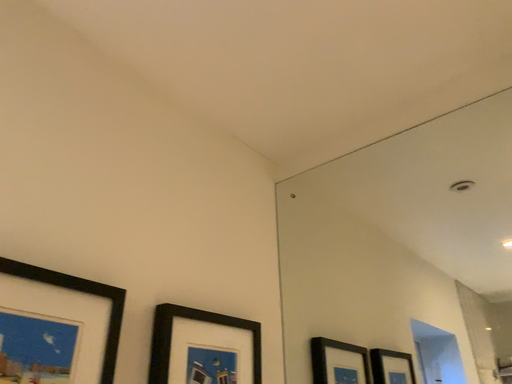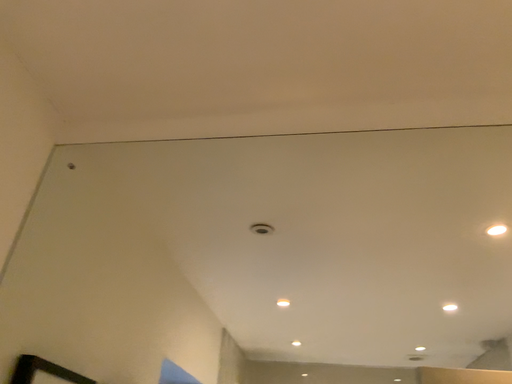
Question: Which way did the camera rotate in the video?

Choices:
 (A) rotated left
 (B) rotated right

Answer: (B)